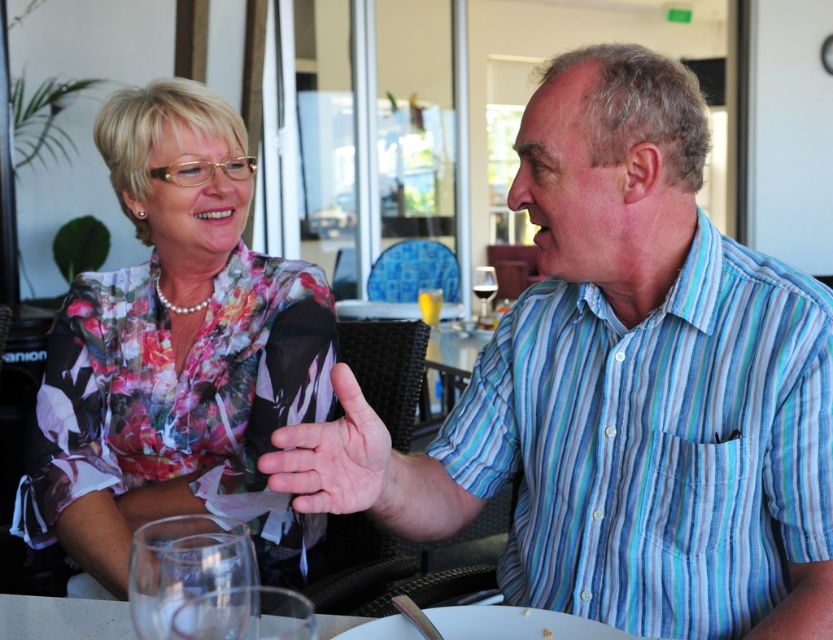
Does blue striped shirt at center appear on the left side of smooth skin hand at center?

Incorrect, blue striped shirt at center is not on the left side of smooth skin hand at center.

Does blue striped shirt at center have a greater width compared to smooth skin hand at center?

Correct, the width of blue striped shirt at center exceeds that of smooth skin hand at center.

Who is more forward, [792,467] or [362,496]?

Point [362,496] is in front.

The width and height of the screenshot is (833, 640). What are the coordinates of `blue striped shirt at center` in the screenshot? It's located at pyautogui.click(x=622, y=388).

Is transparent glass at lower left to the left of transparent glass at upper center from the viewer's perspective?

Indeed, transparent glass at lower left is positioned on the left side of transparent glass at upper center.

Does point (182, 593) lie in front of point (487, 268)?

That is True.

Find the location of a particular element. The image size is (833, 640). transparent glass at lower left is located at coordinates (183, 564).

Can you confirm if white glossy table at lower center is bigger than transparent glass at lower left?

Indeed, white glossy table at lower center has a larger size compared to transparent glass at lower left.

Which is in front, point (65, 630) or point (143, 538)?

Positioned in front is point (143, 538).

Where is `white glossy table at lower center`? This screenshot has width=833, height=640. white glossy table at lower center is located at coordinates (62, 618).